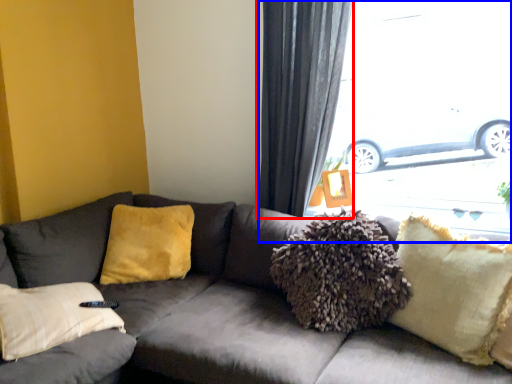
Question: Which object appears farthest to the camera in this image, curtain (highlighted by a red box) or window (highlighted by a blue box)?

Choices:
 (A) curtain
 (B) window

Answer: (B)